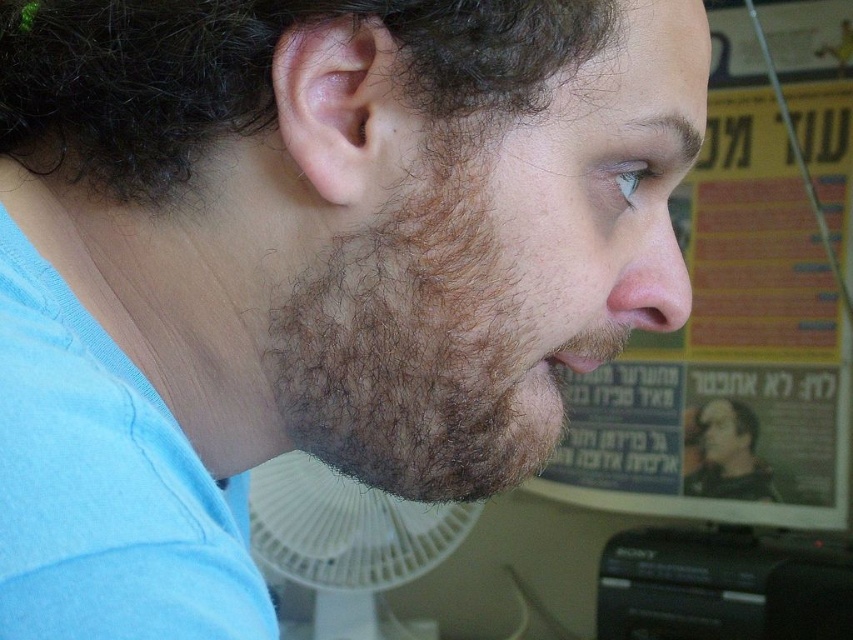
You are an artist trying to sketch the scene. You notice the brown fuzzy beard at lower left and the white plastic fan at lower center. Which object should you draw first if you want to start with the thinner one?

The brown fuzzy beard at lower left is thinner than the white plastic fan at lower center, so you should draw the brown fuzzy beard at lower left first.

You are a delivery robot that needs to place a package on the white plastic fan at lower center without disturbing the dark curly hair at upper left. Given that the robot has a reach of 1.5 meters, can it safely place the package on the fan?

The dark curly hair at upper left and white plastic fan at lower center are 1.61 meters apart from each other. Since the robot can only reach 1.5 meters, it cannot safely place the package on the fan without extending beyond its reach.

You are an artist trying to sketch the scene. To ensure accuracy, you need to know the position of the dark curly hair at upper left relative to the center of the image. Is it closer to the top or the bottom of the image?

The dark curly hair at upper left is located at point 0.116 on the vertical axis, which means it is closer to the top of the image since 0.116 is closer to 0.000 than 1.000.